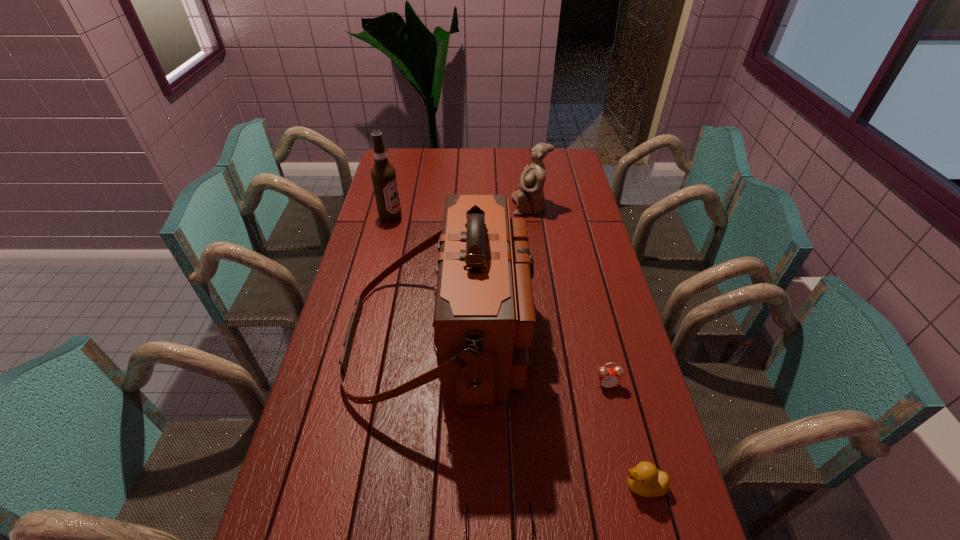
This screenshot has width=960, height=540. I want to click on vacant space located 0.220m on the face of the second nearest object, so click(x=524, y=486).

At what (x,y) coordinates should I click in order to perform the action: click on vacant space located on the face of the second nearest object. Please return your answer as a coordinate pair (x, y). This screenshot has height=540, width=960. Looking at the image, I should click on (590, 486).

This screenshot has width=960, height=540. Find the location of `vacant area located on the face of the second nearest object`. vacant area located on the face of the second nearest object is located at coordinates (541, 486).

Locate an element on the screen. The width and height of the screenshot is (960, 540). vacant region located on the clock face of the alarm clock is located at coordinates (639, 521).

Where is `satchel that is positioned at the left edge`? satchel that is positioned at the left edge is located at coordinates (484, 314).

Locate an element on the screen. alcohol situated at the left edge is located at coordinates (383, 174).

The height and width of the screenshot is (540, 960). What are the coordinates of `duckling situated at the right edge` in the screenshot? It's located at (645, 479).

At what (x,y) coordinates should I click in order to perform the action: click on alarm clock positioned at the right edge. Please return your answer as a coordinate pair (x, y). This screenshot has height=540, width=960. Looking at the image, I should click on (608, 377).

Where is `vacant space at the far edge of the desktop`? This screenshot has width=960, height=540. vacant space at the far edge of the desktop is located at coordinates (428, 170).

In the image, there is a desktop. Where is `vacant space at the left edge`? vacant space at the left edge is located at coordinates (380, 255).